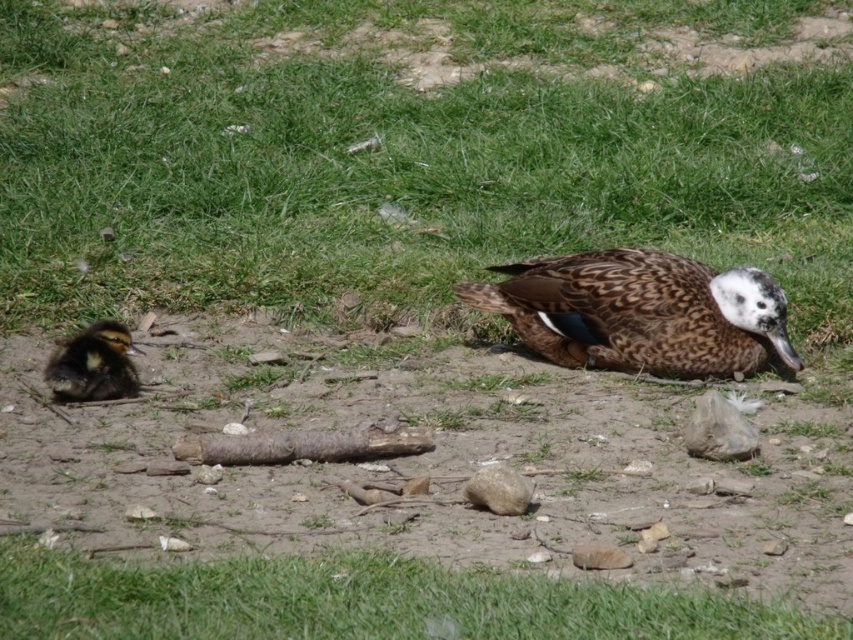
Question: Observing the image, what is the correct spatial positioning of green grass at lower center in reference to brown fluffy duckling at left?

Choices:
 (A) left
 (B) right

Answer: (B)

Question: Which object appears closest to the camera in this image?

Choices:
 (A) green grass at lower center
 (B) brown speckled duck at center
 (C) brown fluffy duckling at left

Answer: (A)

Question: Which point is closer to the camera?

Choices:
 (A) (672, 305)
 (B) (376, 618)

Answer: (B)

Question: Which object appears farthest from the camera in this image?

Choices:
 (A) green grass at lower center
 (B) brown fluffy duckling at left
 (C) brown speckled duck at center

Answer: (C)

Question: Does green grass at lower center appear over brown speckled duck at center?

Choices:
 (A) no
 (B) yes

Answer: (A)

Question: Considering the relative positions of brown speckled duck at center and brown fluffy duckling at left in the image provided, where is brown speckled duck at center located with respect to brown fluffy duckling at left?

Choices:
 (A) below
 (B) above

Answer: (B)